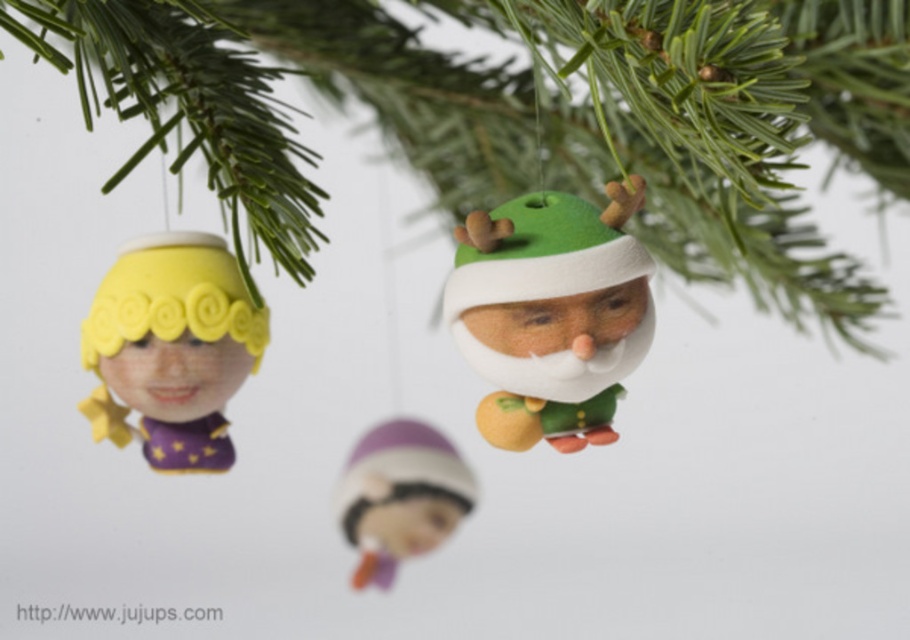
Question: Is green matte santa ornament at upper center above purple matte/soft doll at center?

Choices:
 (A) no
 (B) yes

Answer: (B)

Question: Which point is closer to the camera?

Choices:
 (A) green matte santa ornament at upper center
 (B) matte yellow clay figurine at left
 (C) green felt santa at center
 (D) purple matte/soft doll at center

Answer: (A)

Question: Is green felt santa at center in front of matte yellow clay figurine at left?

Choices:
 (A) no
 (B) yes

Answer: (B)

Question: Based on their relative distances, which object is farther from the purple matte/soft doll at center?

Choices:
 (A) green felt santa at center
 (B) green matte santa ornament at upper center

Answer: (A)

Question: Can you confirm if green felt santa at center is thinner than matte yellow clay figurine at left?

Choices:
 (A) yes
 (B) no

Answer: (A)

Question: Which object is farther from the camera taking this photo?

Choices:
 (A) green felt santa at center
 (B) matte yellow clay figurine at left

Answer: (B)